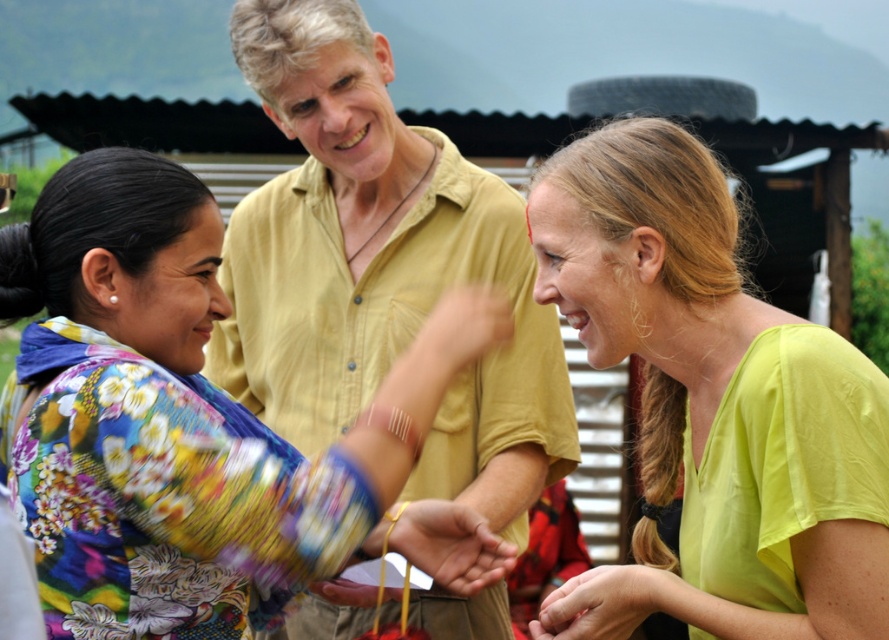
You are a fashion designer observing the scene. You need to determine which clothing item is shorter between the floral fabric blouse at center and the matte yellow shirt at center. Which one is shorter?

The floral fabric blouse at center is shorter than the matte yellow shirt at center.